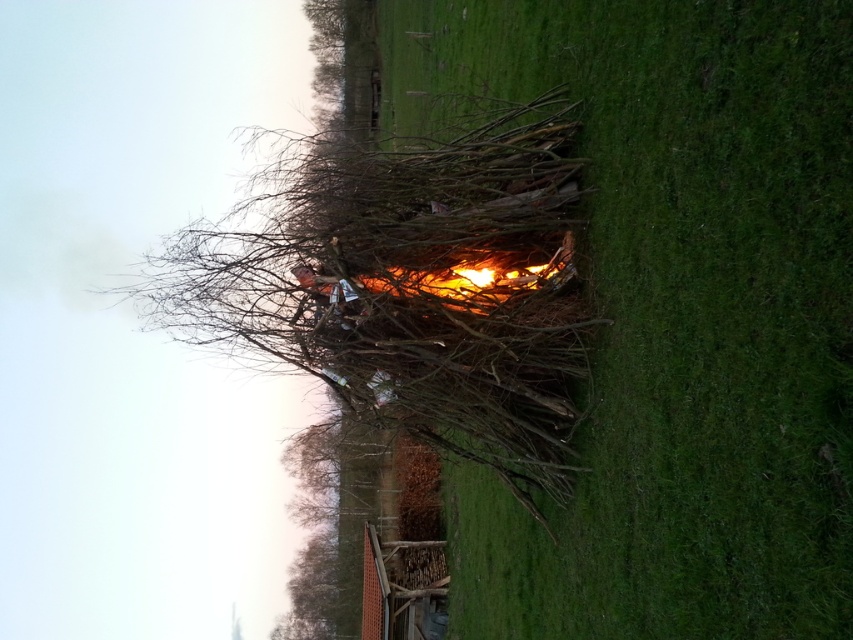
Question: Which point appears closest to the camera in this image?

Choices:
 (A) (733, 582)
 (B) (482, 353)
 (C) (572, 244)

Answer: (A)

Question: Among these points, which one is nearest to the camera?

Choices:
 (A) (489, 300)
 (B) (653, 508)

Answer: (B)

Question: Is green grass at center above bare branches at center?

Choices:
 (A) yes
 (B) no

Answer: (B)

Question: Which of the following is the closest to the observer?

Choices:
 (A) 474,294
 (B) 779,362
 (C) 386,317

Answer: (B)

Question: Can you confirm if green grass at center is wider than bare branches at center?

Choices:
 (A) no
 (B) yes

Answer: (A)

Question: Can you confirm if green grass at center is smaller than bare branches at center?

Choices:
 (A) yes
 (B) no

Answer: (A)